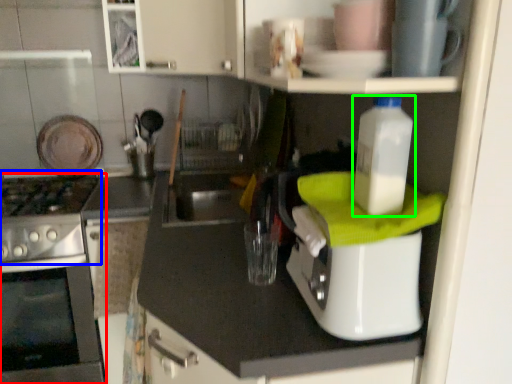
Question: Estimate the real-world distances between objects in this image. Which object is closer to home appliance (highlighted by a red box), gas stove (highlighted by a blue box) or bottle (highlighted by a green box)?

Choices:
 (A) gas stove
 (B) bottle

Answer: (A)